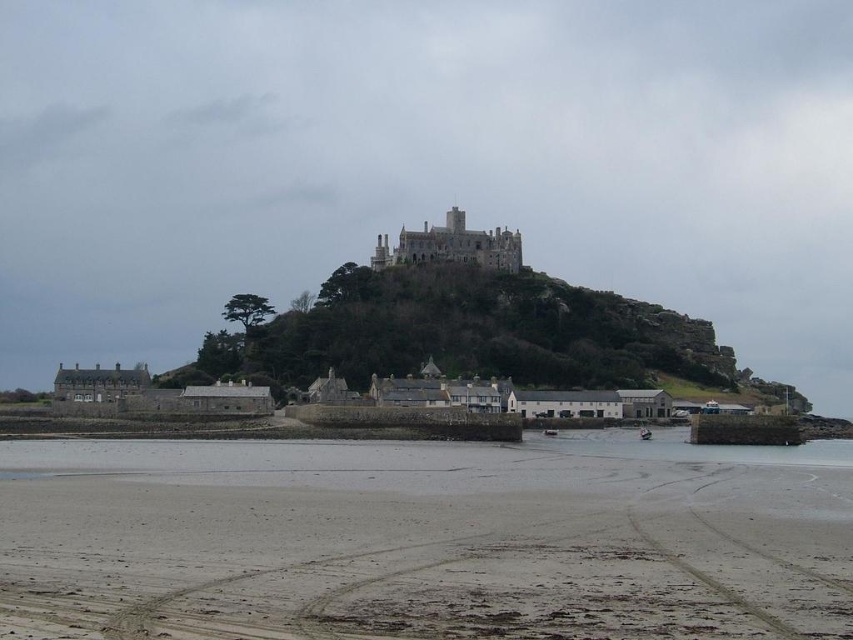
Based on the photo, between sandy beach at lower center and dark gray stone castle at center, which one appears on the right side from the viewer's perspective?

Positioned to the right is dark gray stone castle at center.

Identify the location of sandy beach at lower center. This screenshot has height=640, width=853. (424, 540).

Is point (96, 525) less distant than point (399, 257)?

Yes, point (96, 525) is closer to viewer.

I want to click on sandy beach at lower center, so click(424, 540).

Is clear water at lower center thinner than dark gray stone castle at center?

No.

Which is in front, point (807, 454) or point (421, 234)?

Point (807, 454) is in front.

This screenshot has width=853, height=640. Identify the location of clear water at lower center. (688, 448).

Can you confirm if sandy beach at lower center is wider than green grassy hill at center?

Incorrect, sandy beach at lower center's width does not surpass green grassy hill at center's.

Is sandy beach at lower center above green grassy hill at center?

No.

Which is in front, point (337, 540) or point (601, 355)?

Point (337, 540) is in front.

The height and width of the screenshot is (640, 853). What are the coordinates of `sandy beach at lower center` in the screenshot? It's located at (424, 540).